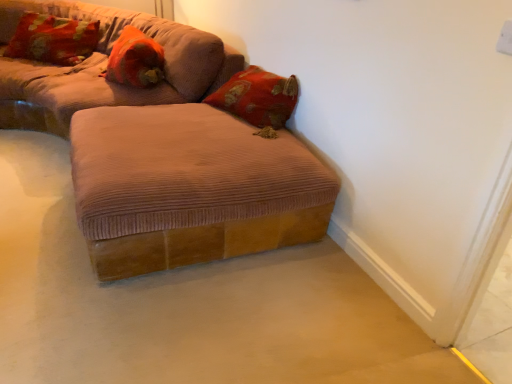
Question: From the image's perspective, does velvet floral pillow at upper left, which is the 1th pillow in left-to-right order, appear higher than brown corduroy ottoman at center?

Choices:
 (A) no
 (B) yes

Answer: (B)

Question: Is the depth of velvet floral pillow at upper left, which is the 1th pillow in left-to-right order, less than that of brown corduroy ottoman at center?

Choices:
 (A) yes
 (B) no

Answer: (B)

Question: Is brown corduroy ottoman at center located within velvet floral pillow at upper left, positioned as the 2th pillow in right-to-left order?

Choices:
 (A) no
 (B) yes

Answer: (A)

Question: Does velvet floral pillow at upper left, which is the 1th pillow in left-to-right order, have a greater width compared to brown corduroy ottoman at center?

Choices:
 (A) yes
 (B) no

Answer: (B)

Question: Could you tell me if velvet floral pillow at upper left, which is the 1th pillow in left-to-right order, is turned towards brown corduroy ottoman at center?

Choices:
 (A) no
 (B) yes

Answer: (A)

Question: In terms of height, does corduroy brown ottoman at lower center, which is the first studio couch in bottom-to-top order, look taller or shorter compared to brown corduroy ottoman at center?

Choices:
 (A) tall
 (B) short

Answer: (A)

Question: Looking at the image, does corduroy brown ottoman at lower center, which is the first studio couch in bottom-to-top order, seem bigger or smaller compared to brown corduroy ottoman at center?

Choices:
 (A) big
 (B) small

Answer: (A)

Question: Considering the relative positions of corduroy brown ottoman at lower center, positioned as the second studio couch in top-to-bottom order, and brown corduroy ottoman at center in the image provided, is corduroy brown ottoman at lower center, positioned as the second studio couch in top-to-bottom order, to the left or to the right of brown corduroy ottoman at center?

Choices:
 (A) left
 (B) right

Answer: (B)

Question: Does point [145, 29] appear closer or farther from the camera than point [358, 316]?

Choices:
 (A) closer
 (B) farther

Answer: (B)

Question: From the image's perspective, is orange corduroy pillow at upper left, marked as the 1th pillow in a right-to-left arrangement, positioned above or below corduroy brown ottoman at center, marked as the 1th studio couch in a top-to-bottom arrangement?

Choices:
 (A) below
 (B) above

Answer: (A)

Question: Choose the correct answer: Is orange corduroy pillow at upper left, marked as the 1th pillow in a right-to-left arrangement, inside corduroy brown ottoman at center, marked as the 1th studio couch in a top-to-bottom arrangement, or outside it?

Choices:
 (A) outside
 (B) inside

Answer: (B)

Question: Is point (146, 51) positioned closer to the camera than point (170, 102)?

Choices:
 (A) closer
 (B) farther

Answer: (B)

Question: From a real-world perspective, is orange corduroy pillow at upper left, marked as the 1th pillow in a right-to-left arrangement, positioned above or below corduroy brown ottoman at center, which is counted as the second studio couch, starting from the bottom?

Choices:
 (A) above
 (B) below

Answer: (A)

Question: In terms of width, does velvet floral pillow at upper left, positioned as the 2th pillow in right-to-left order, look wider or thinner when compared to brown corduroy ottoman at center?

Choices:
 (A) wide
 (B) thin

Answer: (B)

Question: From the image's perspective, is velvet floral pillow at upper left, which is the 1th pillow in left-to-right order, above or below brown corduroy ottoman at center?

Choices:
 (A) above
 (B) below

Answer: (A)